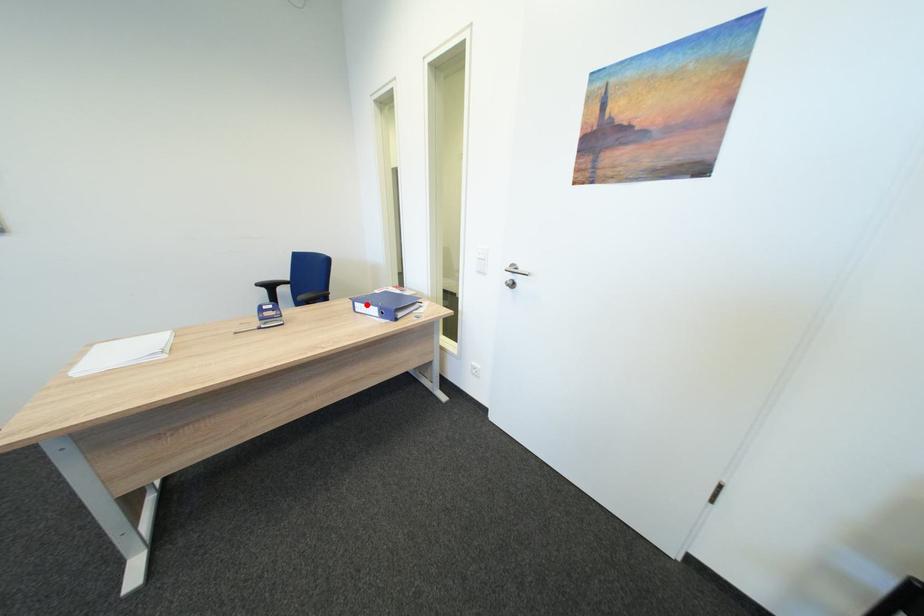
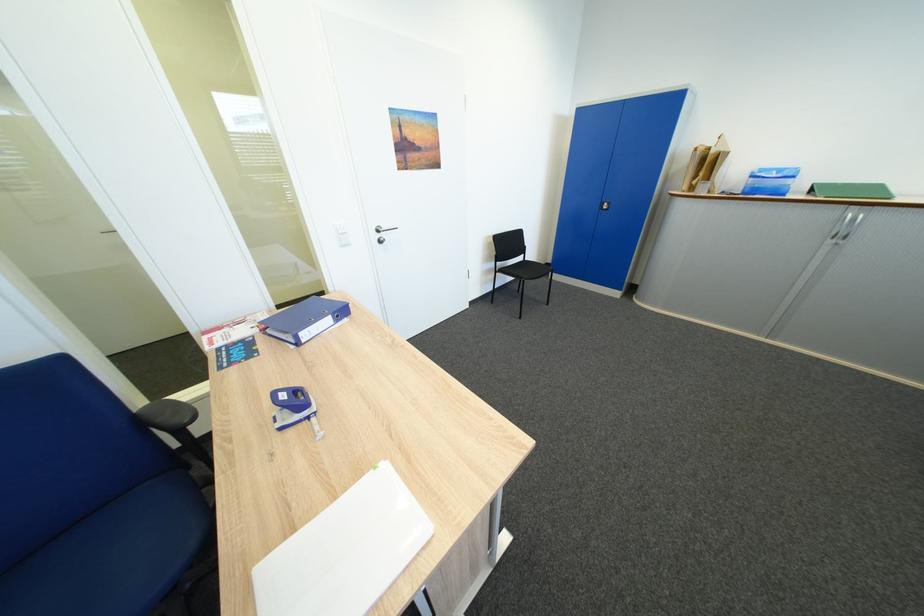
The point at the highlighted location is marked in the first image. Where is the corresponding point in the second image?

(310, 334)